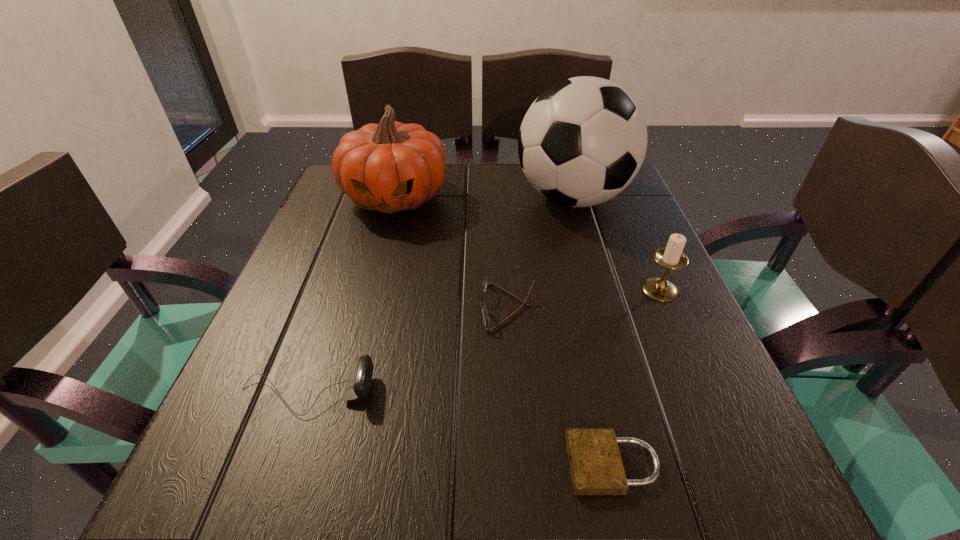
Locate an element on the screen. free space located 0.380m on the left of the third tallest object is located at coordinates (441, 289).

Find the location of `free space located on the front-facing side of the fourth tallest object`. free space located on the front-facing side of the fourth tallest object is located at coordinates (425, 393).

You are a GUI agent. You are given a task and a screenshot of the screen. Output one action in this format:
    pyautogui.click(x=<x>, y=<y>)
    Task: Click on the vacant point located 0.370m on the front-facing side of the fifth tallest object
    The width and height of the screenshot is (960, 540).
    Given the screenshot: What is the action you would take?
    pyautogui.click(x=276, y=307)

Where is `free space located on the front-facing side of the fifth tallest object`? free space located on the front-facing side of the fifth tallest object is located at coordinates (271, 307).

Locate an element on the screen. Image resolution: width=960 pixels, height=540 pixels. free space located 0.070m on the front-facing side of the fifth tallest object is located at coordinates (442, 307).

This screenshot has height=540, width=960. I want to click on vacant area situated 0.080m on the keyhole side of the nearest object, so click(509, 465).

Find the location of a particular element. This screenshot has width=960, height=540. free space located on the keyhole side of the nearest object is located at coordinates (297, 465).

Image resolution: width=960 pixels, height=540 pixels. What are the coordinates of `vacant space located 0.340m on the keyhole side of the nearest object` in the screenshot? It's located at (312, 465).

The width and height of the screenshot is (960, 540). I want to click on soccer ball located at the far edge, so click(583, 140).

The width and height of the screenshot is (960, 540). I want to click on pumpkin at the far edge, so click(389, 167).